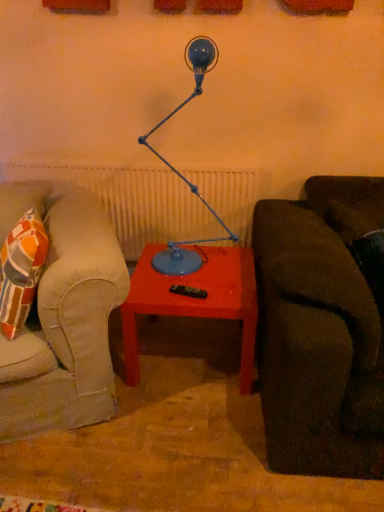
Locate an element on the screen. This screenshot has height=512, width=384. vacant area situated below matte red table at center (from a real-world perspective) is located at coordinates (182, 349).